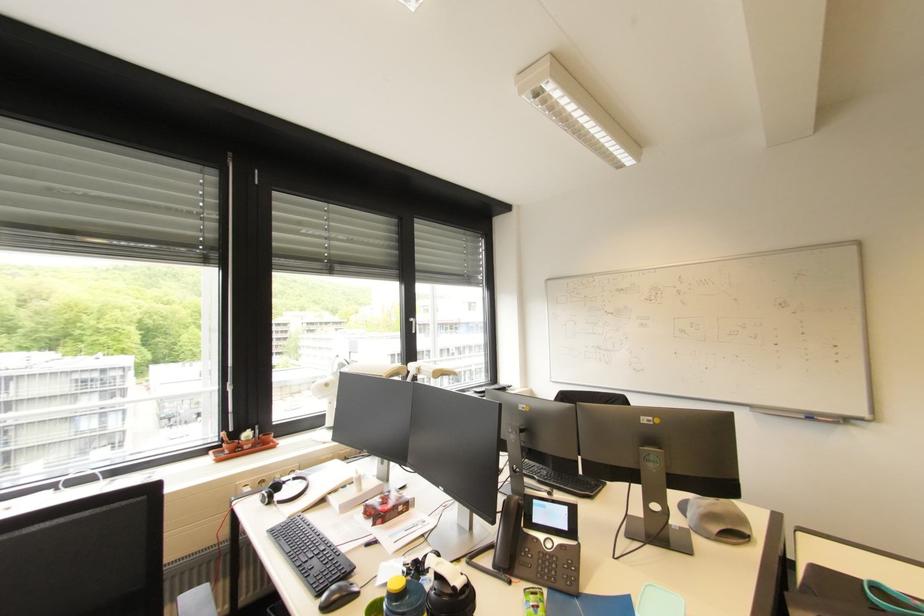
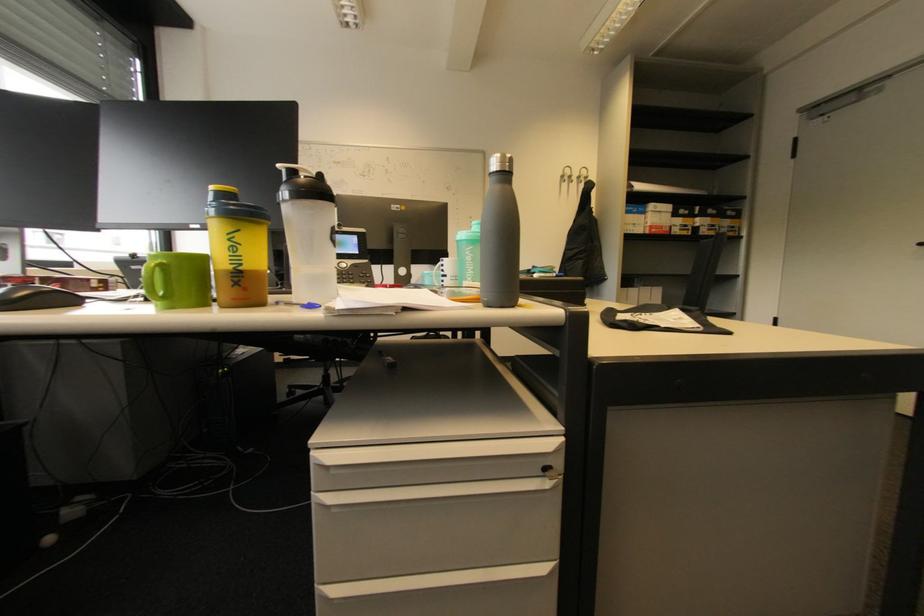
Question: The camera is either moving clockwise (left) or counter-clockwise (right) around the object. The first image is from the beginning of the video and the second image is from the end. Is the camera moving left or right when shooting the video?

Choices:
 (A) Left
 (B) Right

Answer: (A)